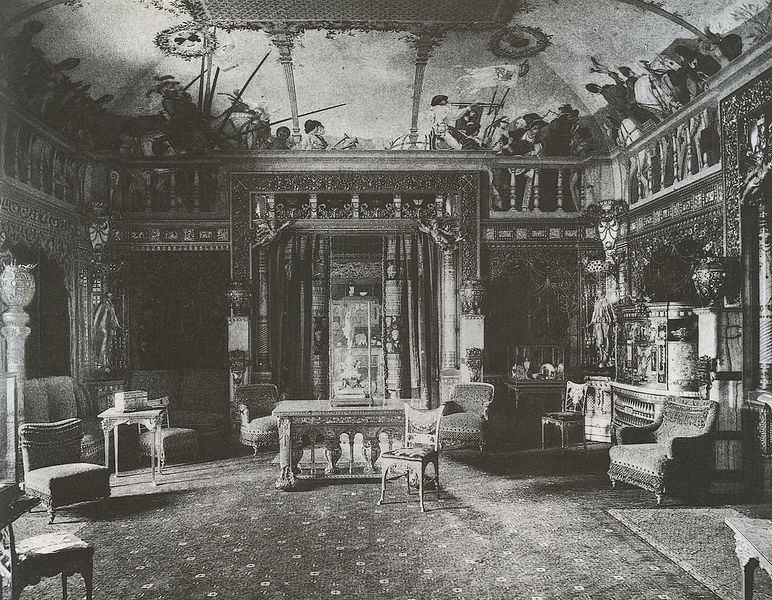
What are the coordinates of `box` in the screenshot? It's located at (134, 394).